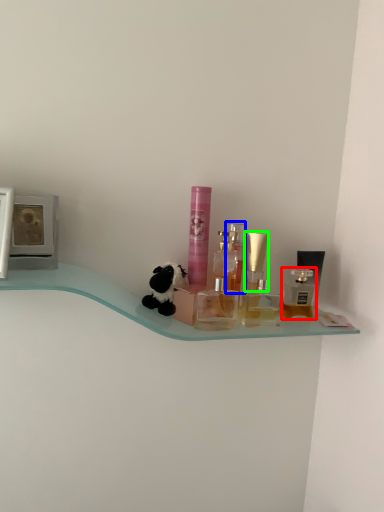
Question: Estimate the real-world distances between objects in this image. Which object is closer to perfume (highlighted by a red box), perfume (highlighted by a blue box) or perfume (highlighted by a green box)?

Choices:
 (A) perfume
 (B) perfume

Answer: (B)